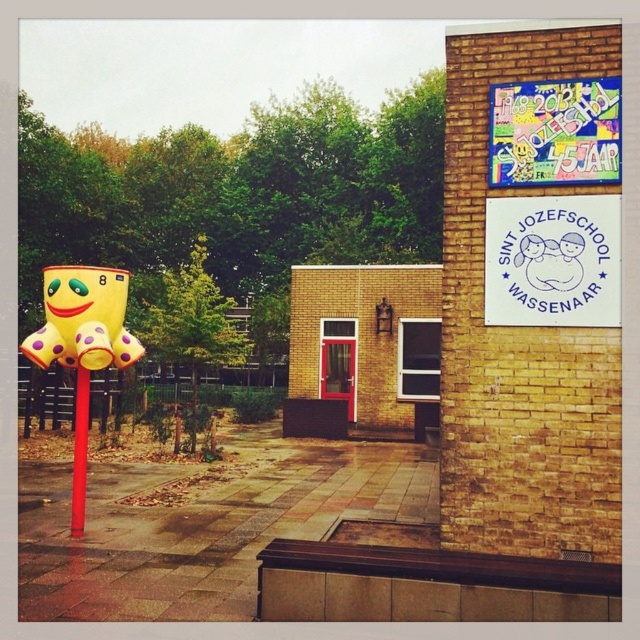
You are a visitor approaching the Sint Jozefschool in Wassenaar. You notice the vibrant paper poster at upper right and the yellow rubber toy at left. Which object is nearer to you as you face the building?

The vibrant paper poster at upper right is closer to the viewer than the yellow rubber toy at left, so the vibrant paper poster at upper right is nearer to you as you face the building.

You are standing in front of the Sint Jozefschool in Wassenaar and want to place a new sign exactly at the center of the image. Where should you position it relative to the yellow rubber toy at left?

The yellow rubber toy at left is located at point (83, 320). To place the new sign at the center of the image, position it at the midpoint between the edges of the image, which is typically at point (320, 320). Since the toy is at (83, 320), the center would be directly below it along the horizontal axis but much lower vertically.